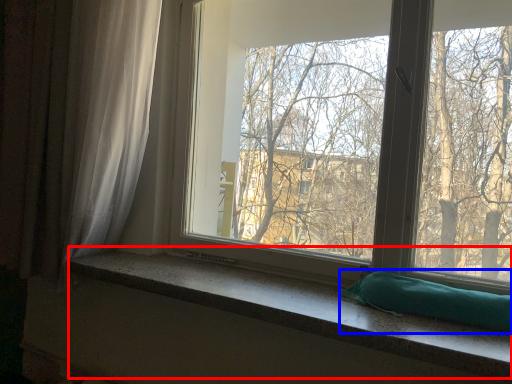
Question: Among these objects, which one is farthest to the camera, window sill (highlighted by a red box) or pillow (highlighted by a blue box)?

Choices:
 (A) window sill
 (B) pillow

Answer: (B)